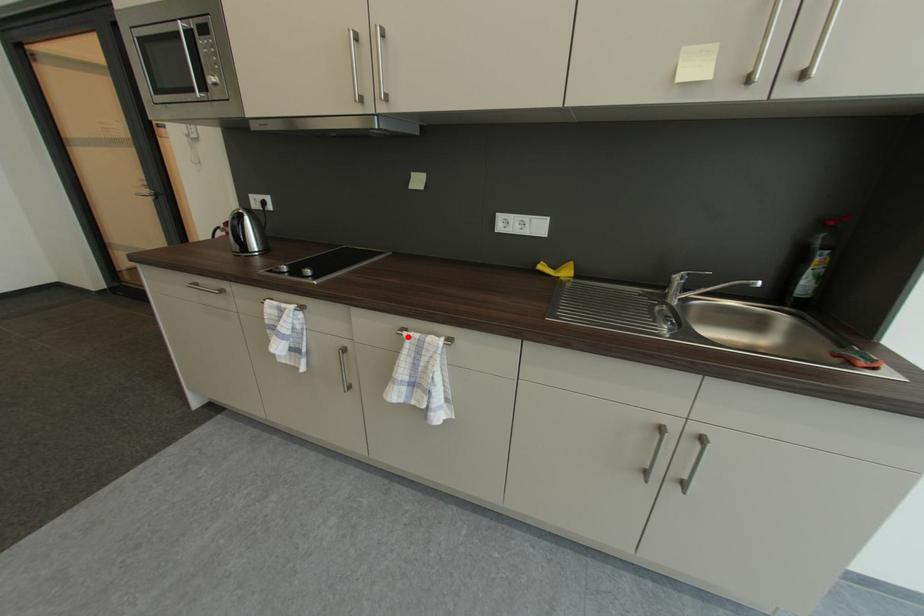
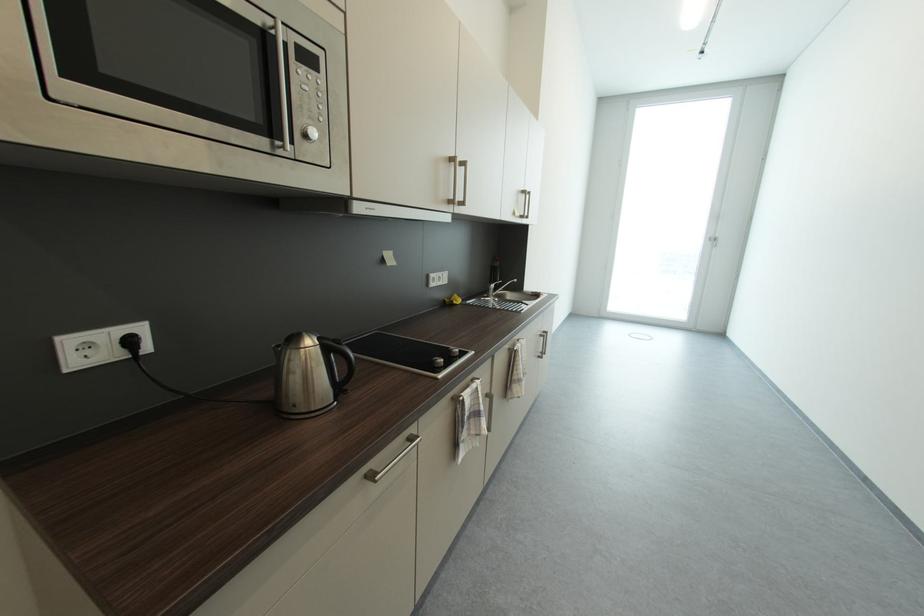
Question: I am providing you with two images of the same scene from different viewpoints. A red point is marked on the first image. At the location where the point appears in image 1, is it still visible in image 2?

Choices:
 (A) Yes
 (B) No

Answer: (A)